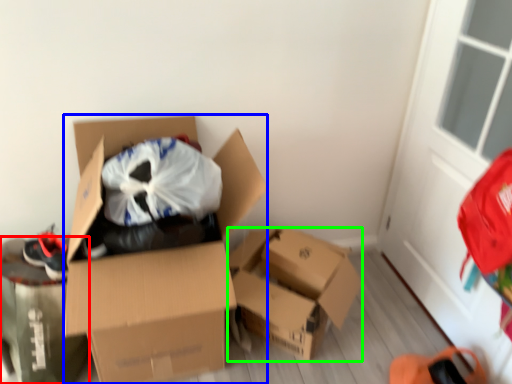
Question: Which object is positioned farthest from cardboard box (highlighted by a red box)? Select from box (highlighted by a blue box) and box (highlighted by a green box).

Choices:
 (A) box
 (B) box

Answer: (B)